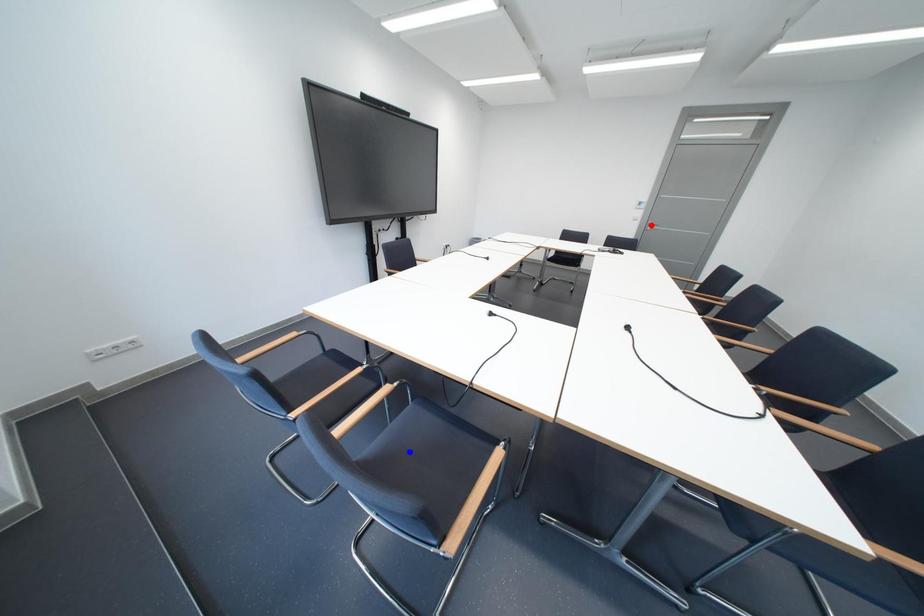
Question: Two points are marked on the image. Which point is closer to the camera?

Choices:
 (A) Blue point is closer.
 (B) Red point is closer.

Answer: (A)